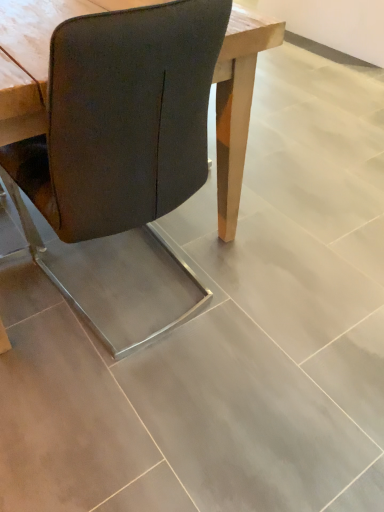
The height and width of the screenshot is (512, 384). What do you see at coordinates (122, 118) in the screenshot?
I see `matte black chair at center` at bounding box center [122, 118].

What are the coordinates of `matte black chair at center` in the screenshot? It's located at (122, 118).

In order to face matte black chair at center, should I rotate leftwards or rightwards?

Turn left approximately 10.693 degrees to face it.

Where is `matte black chair at center`? This screenshot has width=384, height=512. matte black chair at center is located at coordinates (122, 118).